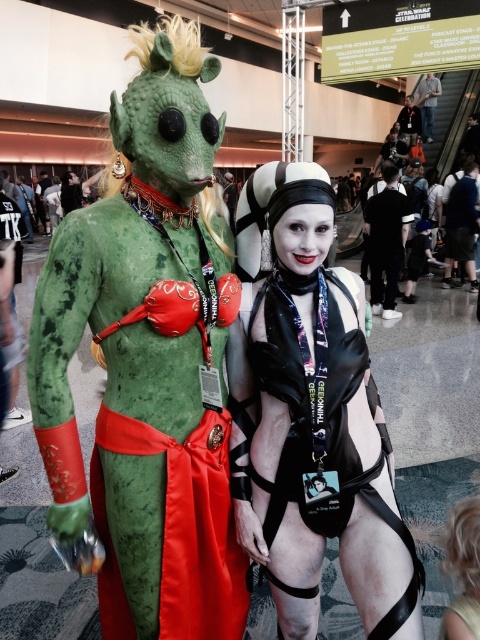
Who is higher up, satin black bodysuit at center or black leather jacket at center?

Positioned higher is black leather jacket at center.

Is satin black bodysuit at center bigger than black leather jacket at center?

No, satin black bodysuit at center is not bigger than black leather jacket at center.

Between point (273, 413) and point (399, 205), which one is positioned behind?

The point (399, 205) is more distant.

Find the location of a particular element. The width and height of the screenshot is (480, 640). satin black bodysuit at center is located at coordinates (312, 417).

From the picture: Who is shorter, green matte skin zombie at center or dark blue fabric pants at right?

Standing shorter between the two is green matte skin zombie at center.

Does point (147, 372) lie behind point (458, 243)?

That is False.

Is point (183, 362) positioned after point (462, 212)?

No, (183, 362) is in front of (462, 212).

Find the location of a particular element. Image resolution: width=480 pixels, height=640 pixels. green matte skin zombie at center is located at coordinates (148, 358).

Between satin black bodysuit at center and matte black helmet at upper center, which one is positioned lower?

satin black bodysuit at center is below.

Does satin black bodysuit at center appear under matte black helmet at upper center?

Indeed, satin black bodysuit at center is positioned under matte black helmet at upper center.

Locate an element on the screen. satin black bodysuit at center is located at coordinates (312, 417).